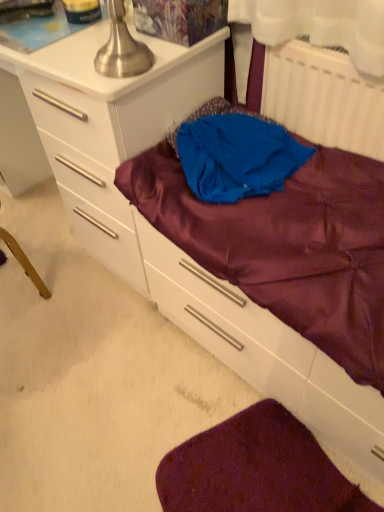
Question: From a real-world perspective, is satin purple drawer at center above or below blue fabric at center?

Choices:
 (A) below
 (B) above

Answer: (A)

Question: Is satin purple drawer at center wider or thinner than blue fabric at center?

Choices:
 (A) thin
 (B) wide

Answer: (B)

Question: Which of these objects is positioned closest to the white plastic radiator at upper right?

Choices:
 (A) satin purple drawer at center
 (B) satin purple mattress at center
 (C) blue fabric at center
 (D) white glossy chest of drawers at center
 (E) purple satin sheet at lower right

Answer: (C)

Question: Estimate the real-world distances between objects in this image. Which object is farther from the satin purple mattress at center?

Choices:
 (A) white glossy chest of drawers at center
 (B) satin purple drawer at center
 (C) purple satin sheet at lower right
 (D) white plastic radiator at upper right
 (E) blue fabric at center

Answer: (C)